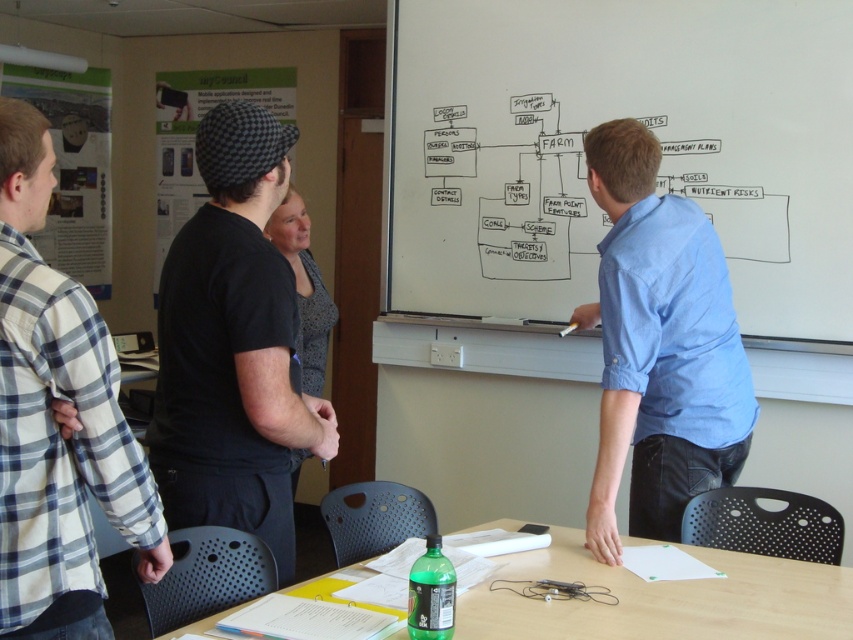
Who is higher up, whiteboard at center or plaid cotton shirt at left?

whiteboard at center

Is point (730, 38) behind point (39, 285)?

Yes, it is behind point (39, 285).

Is point (703, 61) closer to camera compared to point (68, 388)?

No, it is behind (68, 388).

Image resolution: width=853 pixels, height=640 pixels. Identify the location of whiteboard at center. (607, 120).

Which is below, whiteboard at center or blue cotton shirt at center?

blue cotton shirt at center is below.

Is whiteboard at center in front of blue cotton shirt at center?

No.

Between point (775, 100) and point (711, 230), which one is positioned in front?

Positioned in front is point (711, 230).

At what (x,y) coordinates should I click in order to perform the action: click on whiteboard at center. Please return your answer as a coordinate pair (x, y). Looking at the image, I should click on (607, 120).

Between blue cotton shirt at center and green plastic bottle at lower center, which one appears on the left side from the viewer's perspective?

Positioned to the left is green plastic bottle at lower center.

Is blue cotton shirt at center thinner than green plastic bottle at lower center?

Yes, blue cotton shirt at center is thinner than green plastic bottle at lower center.

Identify the location of blue cotton shirt at center. (659, 346).

Find the location of `blue cotton shirt at center`. blue cotton shirt at center is located at coordinates (659, 346).